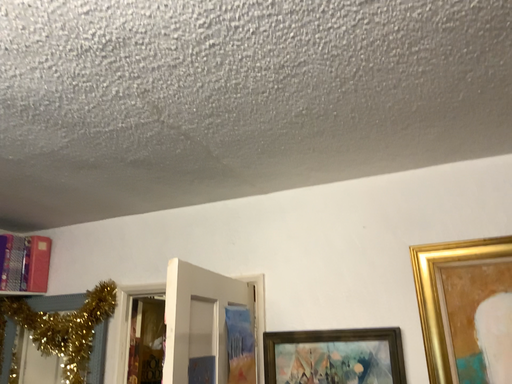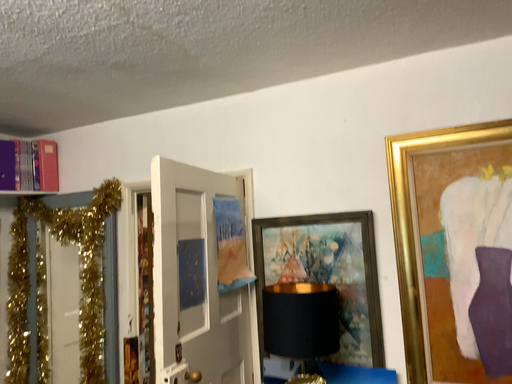
Question: How did the camera likely rotate when shooting the video?

Choices:
 (A) rotated downward
 (B) rotated upward

Answer: (A)